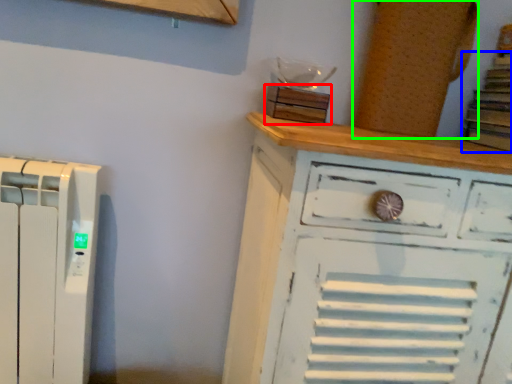
Question: Which object is positioned farthest from wood (highlighted by a red box)? Select from book (highlighted by a blue box) and wood (highlighted by a green box).

Choices:
 (A) book
 (B) wood

Answer: (A)